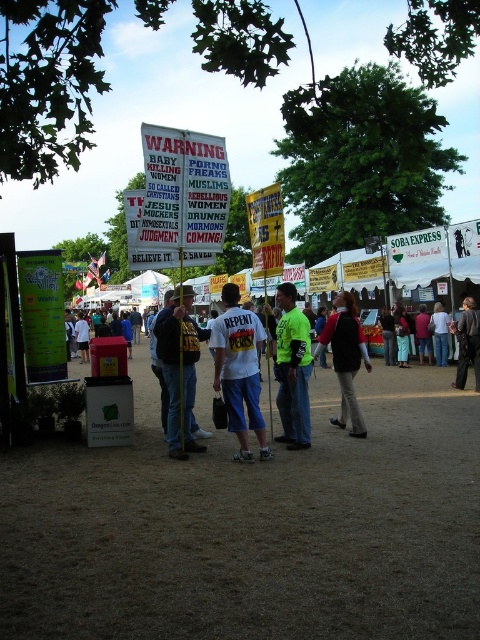
You are a photographer at the fair and want to capture a photo of the white matte shirt at center and light blue jeans at center. Which one should you focus on first if you want to include both in the frame without moving the camera?

A: The white matte shirt at center is located below light blue jeans at center, so you should focus on the light blue jeans at center first since it is higher up and will be in the upper part of the frame, allowing both to be captured without adjusting the camera position.

You are standing at the position of point (356, 401) and want to move to the position of point (184, 433). Which direction should you move relative to the banners?

You should move forward relative to the banners because point (184, 433) is in front of point (356, 401).